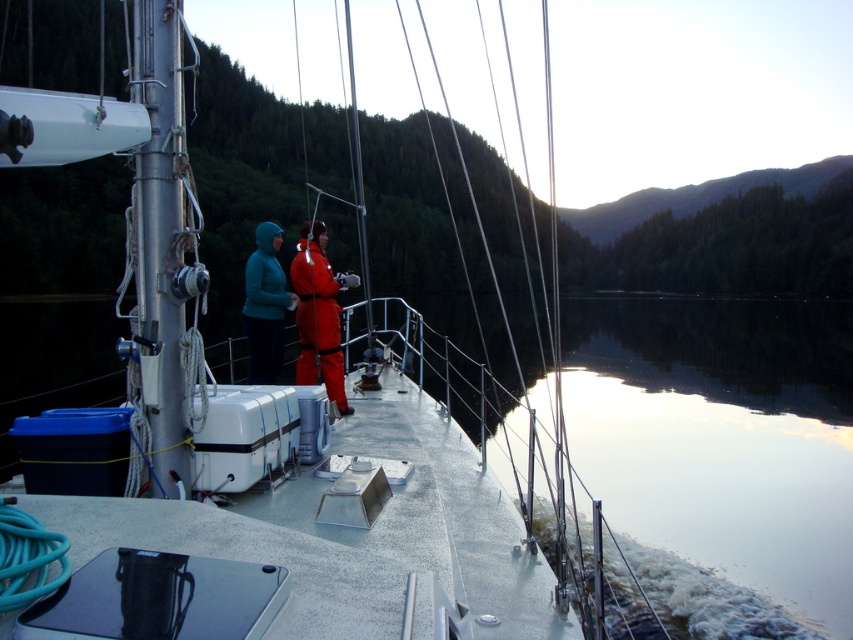
Which is more to the left, matte orange jumpsuit at center or matte blue jacket at center?

From the viewer's perspective, matte blue jacket at center appears more on the left side.

Is matte orange jumpsuit at center positioned before matte blue jacket at center?

Yes, it is in front of matte blue jacket at center.

You are a GUI agent. You are given a task and a screenshot of the screen. Output one action in this format:
    pyautogui.click(x=<x>, y=<y>)
    Task: Click on the matte orange jumpsuit at center
    The image size is (853, 640).
    Given the screenshot: What is the action you would take?
    click(318, 314)

Can you confirm if clear water at lower right is positioned above matte orange jumpsuit at center?

Incorrect, clear water at lower right is not positioned above matte orange jumpsuit at center.

Is clear water at lower right bigger than matte orange jumpsuit at center?

Indeed, clear water at lower right has a larger size compared to matte orange jumpsuit at center.

Locate an element on the screen. The width and height of the screenshot is (853, 640). clear water at lower right is located at coordinates (720, 456).

The height and width of the screenshot is (640, 853). What are the coordinates of `clear water at lower right` in the screenshot? It's located at (720, 456).

What are the coordinates of `clear water at lower right` in the screenshot? It's located at (720, 456).

Between clear water at lower right and matte blue jacket at center, which one appears on the left side from the viewer's perspective?

matte blue jacket at center

I want to click on clear water at lower right, so click(x=720, y=456).